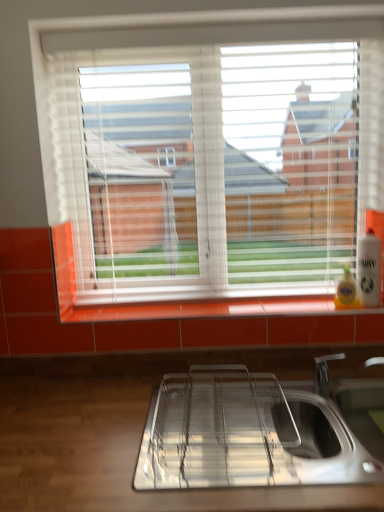
Locate an element on the screen. The height and width of the screenshot is (512, 384). free point below white plastic blinds at upper center (from a real-world perspective) is located at coordinates (177, 295).